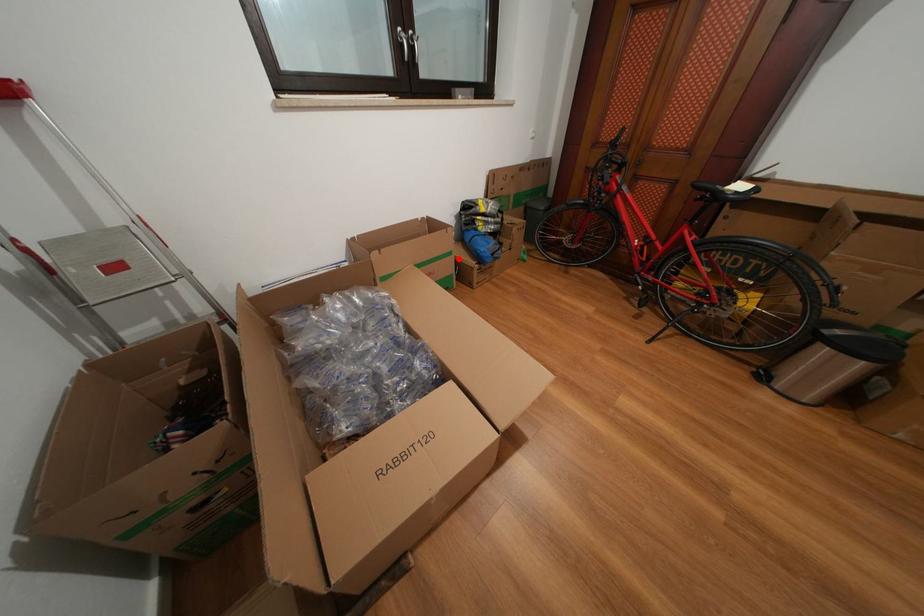
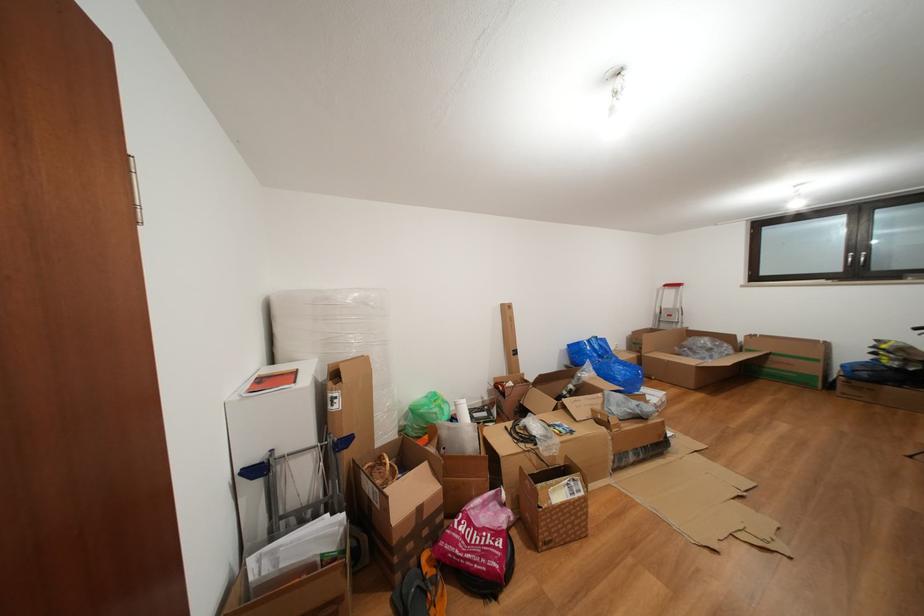
Locate, in the second image, the point that corresponds to the highlighted location in the first image.

(824, 366)